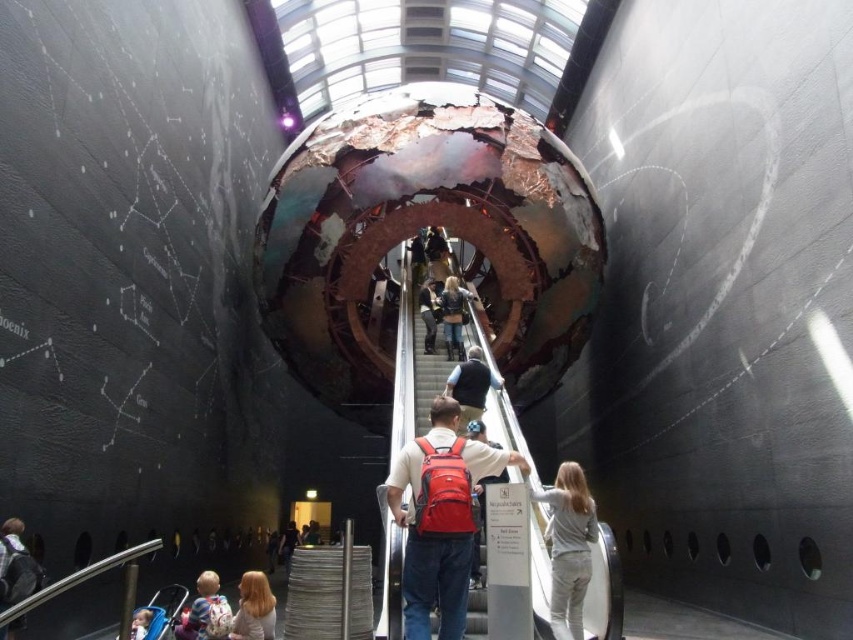
You are standing in the center of the tunnel and want to locate the rusty metal sphere at center. According to the coordinates provided, where should you look relative to your position?

The rusty metal sphere at center is located at coordinates approximately 0.492 on the x axis and 0.531 on the y axis, which is very close to the center point of the space.

You are a visitor standing in the interior space described. You notice the rusty metal sphere at center and the light brown fabric baby at lower left. Which object is positioned higher in the space?

The rusty metal sphere at center is located above the light brown fabric baby at lower left, so it is positioned higher in the space.

Based on the photo, you are an interior designer planning to place a new piece of furniture in the room. You have a small chair that is 0.5 meters wide. Considering the space between the red backpack at center and the light brown fabric baby at lower left, can the chair fit there?

The red backpack at center is larger in size than the light brown fabric baby at lower left. However, the exact distance between them isn not specified in the provided description. Without knowing the space between them, it is impossible to determine if the chair will fit.